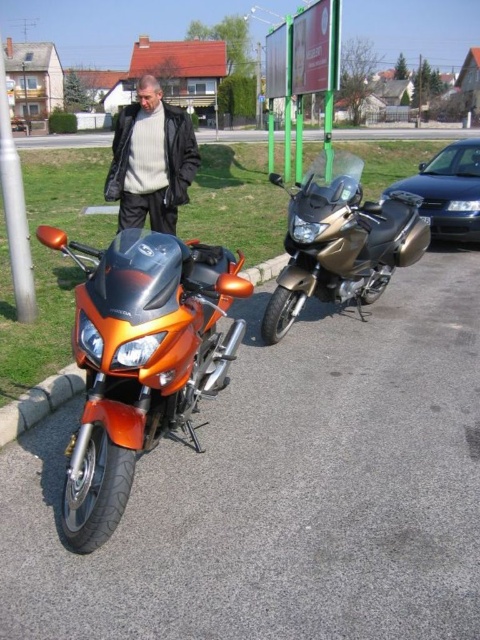
Question: Which point is closer to the camera?

Choices:
 (A) orange metallic motorcycle at lower left
 (B) matte black jacket at center
 (C) metallic blue sedan at right

Answer: (A)

Question: Considering the real-world distances, which object is farthest from the orange metallic motorcycle at lower left?

Choices:
 (A) silver metallic pole at left
 (B) gold metallic motorcycle at center

Answer: (A)

Question: Which is nearer to the orange metallic motorcycle at lower left?

Choices:
 (A) matte black jacket at center
 (B) metallic blue sedan at right
 (C) gold metallic motorcycle at center

Answer: (C)

Question: Does gold metallic motorcycle at center have a lesser width compared to matte black jacket at center?

Choices:
 (A) no
 (B) yes

Answer: (B)

Question: Is orange metallic motorcycle at lower left to the right of silver metallic pole at left from the viewer's perspective?

Choices:
 (A) yes
 (B) no

Answer: (A)

Question: Can you confirm if metallic blue sedan at right is positioned to the right of silver metallic pole at left?

Choices:
 (A) no
 (B) yes

Answer: (B)